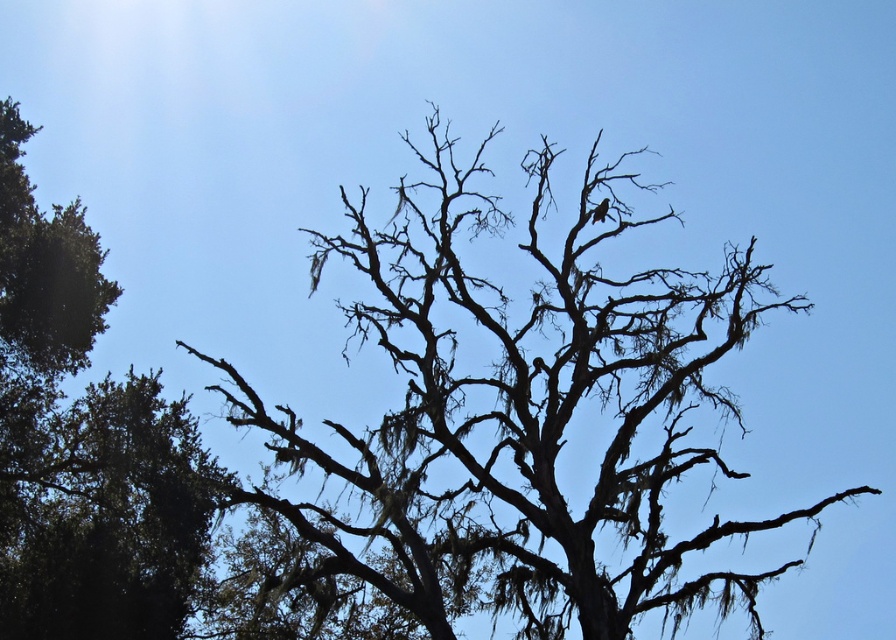
Question: Which object appears closest to the camera in this image?

Choices:
 (A) green leafy tree at left
 (B) silhouette bark tree at center

Answer: (A)

Question: Is silhouette bark tree at center behind green leafy tree at left?

Choices:
 (A) yes
 (B) no

Answer: (A)

Question: Observing the image, what is the correct spatial positioning of silhouette bark tree at center in reference to green leafy tree at left?

Choices:
 (A) above
 (B) below

Answer: (B)

Question: Does silhouette bark tree at center lie behind green leafy tree at left?

Choices:
 (A) no
 (B) yes

Answer: (B)